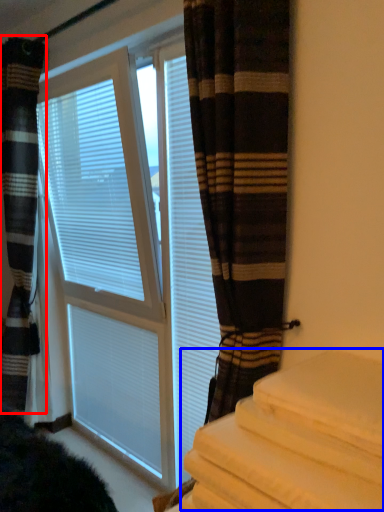
Question: Which object appears closest to the camera in this image, curtain (highlighted by a red box) or bedding (highlighted by a blue box)?

Choices:
 (A) curtain
 (B) bedding

Answer: (B)